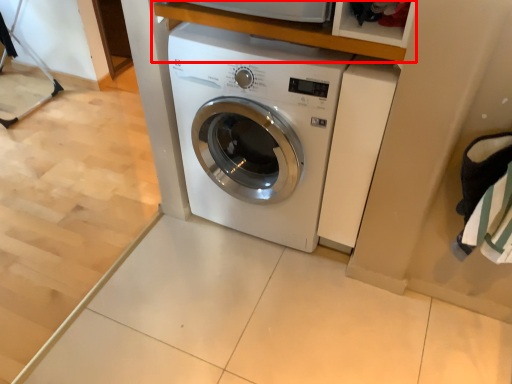
Question: In this image, where is shelf (annotated by the red box) located relative to washing machine?

Choices:
 (A) right
 (B) left

Answer: (A)